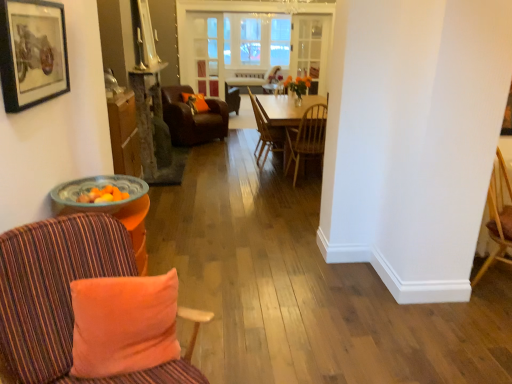
Question: Can you confirm if striped fabric chair at left, arranged as the first chair when viewed from the front, is positioned to the right of wooden chair at center, which is counted as the 2th chair, starting from the front?

Choices:
 (A) no
 (B) yes

Answer: (A)

Question: Considering the relative sizes of striped fabric chair at left, positioned as the fourth chair in back-to-front order, and wooden chair at center, which is counted as the 2th chair, starting from the front, in the image provided, is striped fabric chair at left, positioned as the fourth chair in back-to-front order, wider than wooden chair at center, which is counted as the 2th chair, starting from the front,?

Choices:
 (A) no
 (B) yes

Answer: (B)

Question: From the image's perspective, does striped fabric chair at left, positioned as the fourth chair in back-to-front order, appear higher than wooden chair at center, which is the 3th chair in back-to-front order?

Choices:
 (A) no
 (B) yes

Answer: (A)

Question: Is striped fabric chair at left, arranged as the first chair when viewed from the front, next to wooden chair at center, which is counted as the 2th chair, starting from the front?

Choices:
 (A) no
 (B) yes

Answer: (A)

Question: From a real-world perspective, is striped fabric chair at left, positioned as the fourth chair in back-to-front order, physically below wooden chair at center, which is counted as the 2th chair, starting from the front?

Choices:
 (A) yes
 (B) no

Answer: (A)

Question: Considering their positions, is wooden chair at center, which is the 3th chair in back-to-front order, located in front of or behind orange plush pillow at lower left, which is the second pillow in left-to-right order?

Choices:
 (A) behind
 (B) front

Answer: (A)

Question: Based on their positions, is wooden chair at center, which is counted as the 2th chair, starting from the front, located to the left or right of orange plush pillow at lower left, the 1th pillow when ordered from bottom to top?

Choices:
 (A) right
 (B) left

Answer: (A)

Question: Is wooden chair at center, which is counted as the 2th chair, starting from the front, spatially inside orange plush pillow at lower left, which is the second pillow in left-to-right order, or outside of it?

Choices:
 (A) inside
 (B) outside

Answer: (B)

Question: From a real-world perspective, is wooden chair at center, which is counted as the 2th chair, starting from the front, physically located above or below orange plush pillow at lower left, the first pillow viewed from the right?

Choices:
 (A) above
 (B) below

Answer: (B)

Question: From the image's perspective, is light wood table at center above or below striped fabric chair at left, arranged as the first chair when viewed from the front?

Choices:
 (A) below
 (B) above

Answer: (B)

Question: From a real-world perspective, is light wood table at center above or below striped fabric chair at left, positioned as the fourth chair in back-to-front order?

Choices:
 (A) above
 (B) below

Answer: (B)

Question: Which is correct: light wood table at center is inside striped fabric chair at left, arranged as the first chair when viewed from the front, or outside of it?

Choices:
 (A) outside
 (B) inside

Answer: (A)

Question: Considering the positions of light wood table at center and striped fabric chair at left, arranged as the first chair when viewed from the front, in the image, is light wood table at center taller or shorter than striped fabric chair at left, arranged as the first chair when viewed from the front,?

Choices:
 (A) short
 (B) tall

Answer: (A)

Question: From a real-world perspective, relative to wooden chair at center, which is counted as the 2th chair, starting from the front, is wooden chair at center, positioned as the 2th chair in back-to-front order, vertically above or below?

Choices:
 (A) above
 (B) below

Answer: (B)

Question: Is wooden chair at center, positioned as the 2th chair in back-to-front order, bigger or smaller than wooden chair at center, which is counted as the 2th chair, starting from the front?

Choices:
 (A) big
 (B) small

Answer: (B)